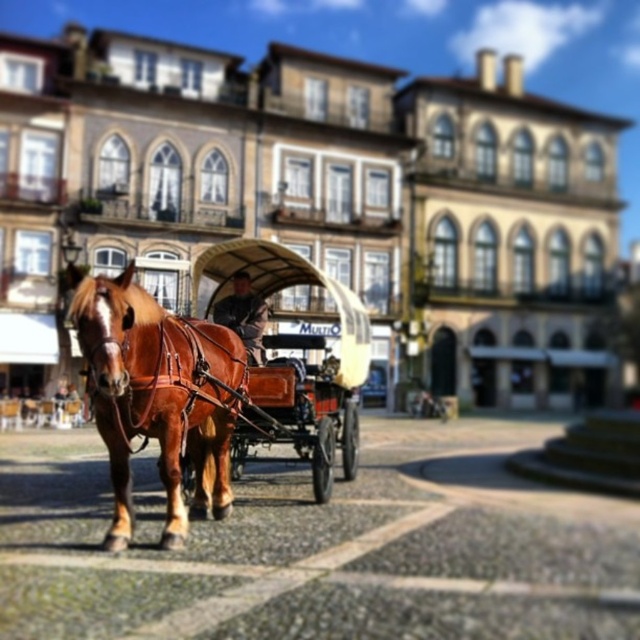
Is shiny brown leather horse cart at center shorter than wooden polished coach at center?

No, shiny brown leather horse cart at center is not shorter than wooden polished coach at center.

Based on the photo, is shiny brown leather horse cart at center closer to camera compared to wooden polished coach at center?

Yes, shiny brown leather horse cart at center is closer to the viewer.

Locate an element on the screen. shiny brown leather horse cart at center is located at coordinates (294, 362).

Who is lower down, shiny brown horse at center or wooden polished coach at center?

Positioned lower is shiny brown horse at center.

Does point (99, 317) come in front of point (246, 320)?

That is True.

Image resolution: width=640 pixels, height=640 pixels. Identify the location of shiny brown horse at center. (157, 396).

Is shiny brown horse at center below shiny brown leather horse cart at center?

Indeed, shiny brown horse at center is positioned under shiny brown leather horse cart at center.

Who is more distant from viewer, (170,422) or (289,250)?

Positioned behind is point (289,250).

Which is in front, point (93, 307) or point (241, 252)?

Point (93, 307)

Identify the location of shiny brown horse at center. point(157,396).